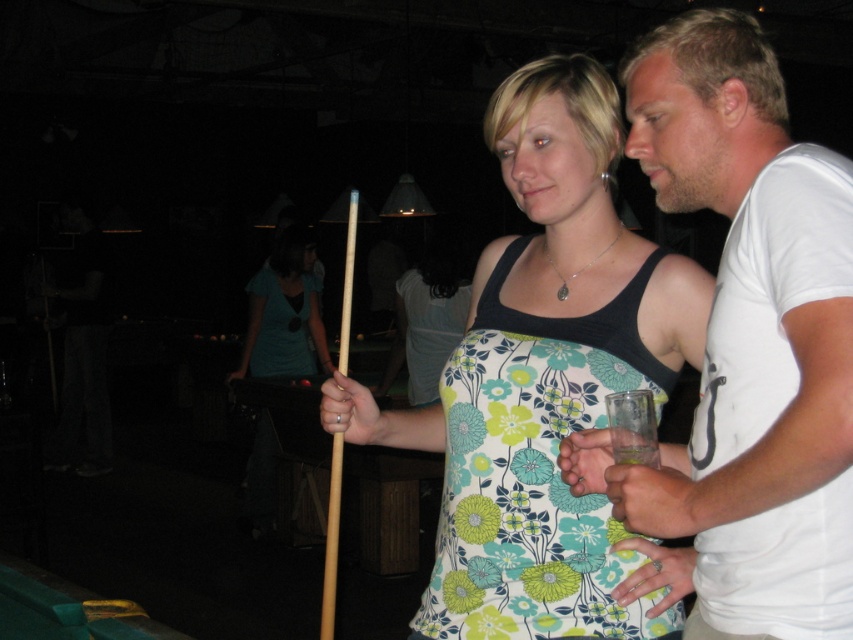
Between green felt billiard table at lower left and wooden cue at center, which one appears on the right side from the viewer's perspective?

From the viewer's perspective, wooden cue at center appears more on the right side.

This screenshot has height=640, width=853. In order to click on green felt billiard table at lower left in this screenshot , I will do `click(59, 609)`.

Locate an element on the screen. This screenshot has width=853, height=640. green felt billiard table at lower left is located at coordinates (59, 609).

From the picture: Is matte blue shirt at center to the right of wooden cue at center from the viewer's perspective?

Incorrect, matte blue shirt at center is not on the right side of wooden cue at center.

Is matte blue shirt at center positioned behind wooden cue at center?

Yes, matte blue shirt at center is further from the viewer.

What do you see at coordinates (283, 316) in the screenshot? The width and height of the screenshot is (853, 640). I see `matte blue shirt at center` at bounding box center [283, 316].

The image size is (853, 640). In order to click on matte blue shirt at center in this screenshot , I will do `click(283, 316)`.

Does floral fabric dress at center appear on the left side of wooden cue at center?

No, floral fabric dress at center is not to the left of wooden cue at center.

Which is more to the left, floral fabric dress at center or wooden cue at center?

Positioned to the left is wooden cue at center.

Which is behind, point (473, 612) or point (334, 513)?

The point (334, 513) is behind.

At what (x,y) coordinates should I click in order to perform the action: click on floral fabric dress at center. Please return your answer as a coordinate pair (x, y). The width and height of the screenshot is (853, 640). Looking at the image, I should click on (543, 376).